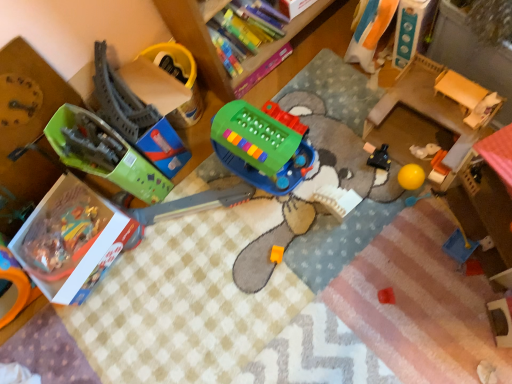
You are a GUI agent. You are given a task and a screenshot of the screen. Output one action in this format:
    pyautogui.click(x=<x>, y=<y>)
    Task: Click on the vacant space that is to the left of blue plastic dustpan at lower right, the 6th toy in the left-to-right sequence
    This screenshot has height=384, width=512.
    Given the screenshot: What is the action you would take?
    pyautogui.click(x=403, y=277)